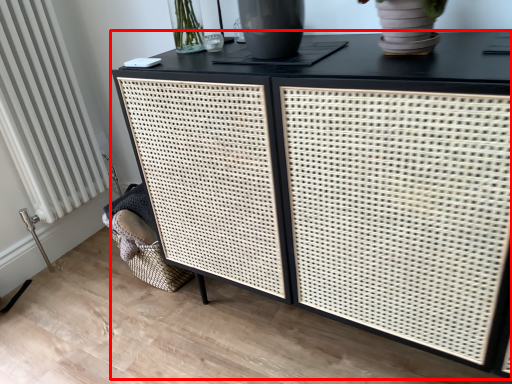
Question: From the image's perspective, what is the correct spatial positioning of table (annotated by the red box) in reference to radiator?

Choices:
 (A) below
 (B) above

Answer: (A)